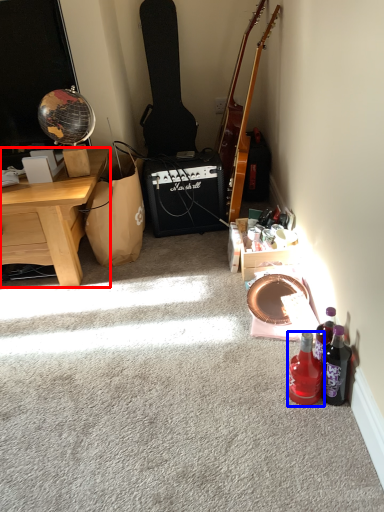
Question: Which point is further to the camera, desk (highlighted by a red box) or bottle (highlighted by a blue box)?

Choices:
 (A) desk
 (B) bottle

Answer: (A)